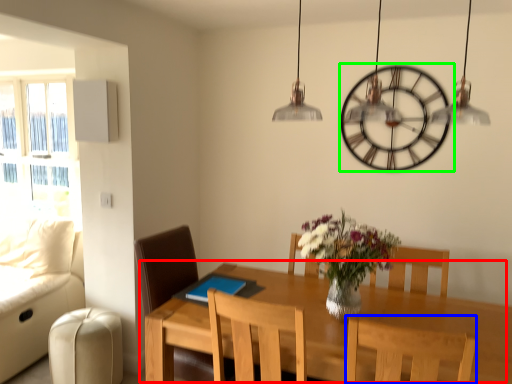
Question: Which object is the closest to the table (highlighted by a red box)? Choose among these: chair (highlighted by a blue box) or wall clock (highlighted by a green box).

Choices:
 (A) chair
 (B) wall clock

Answer: (A)